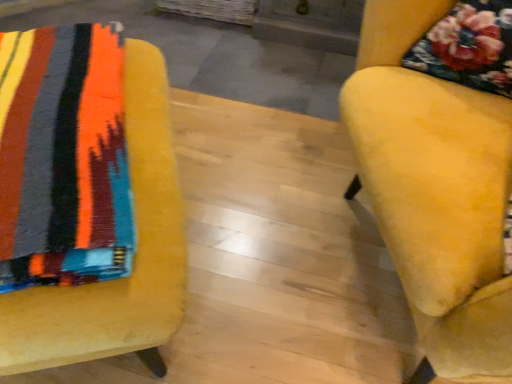
In order to click on vacant space in between velvet yellow chair at right, which is the 1th chair in right-to-left order, and velvet yellow chair at left, which is the second chair in right-to-left order in this screenshot , I will do 250,256.